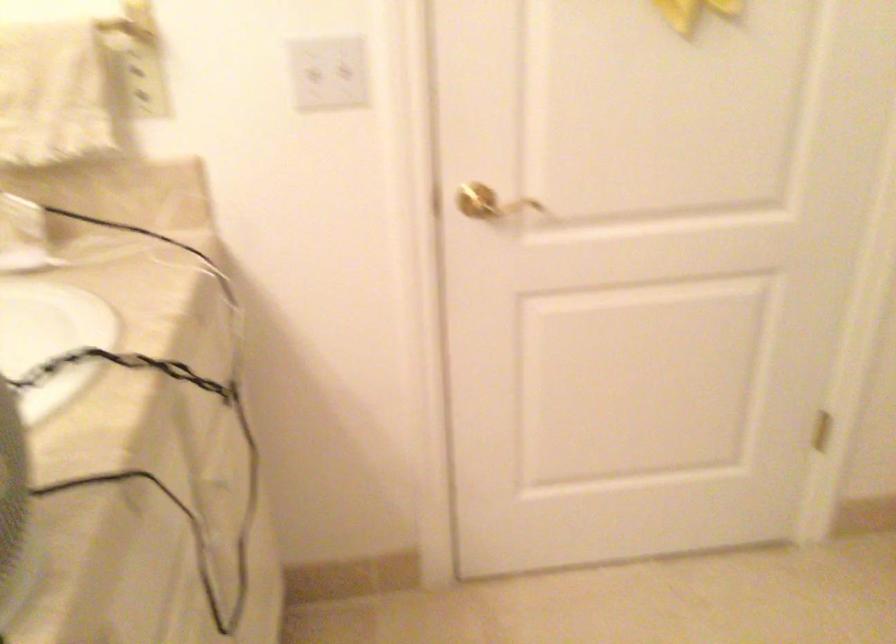
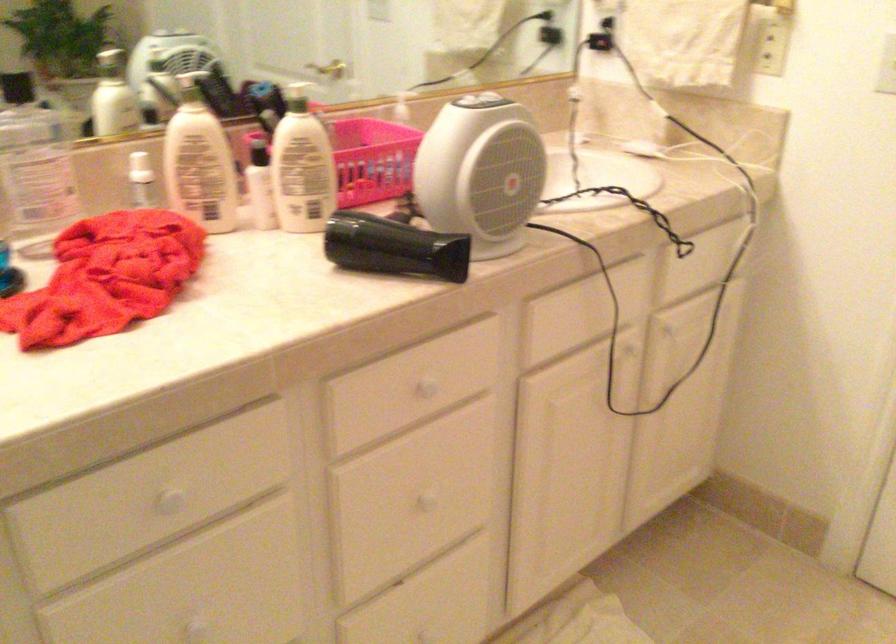
Locate, in the second image, the point that corresponds to (x=238, y=471) in the first image.

(675, 335)